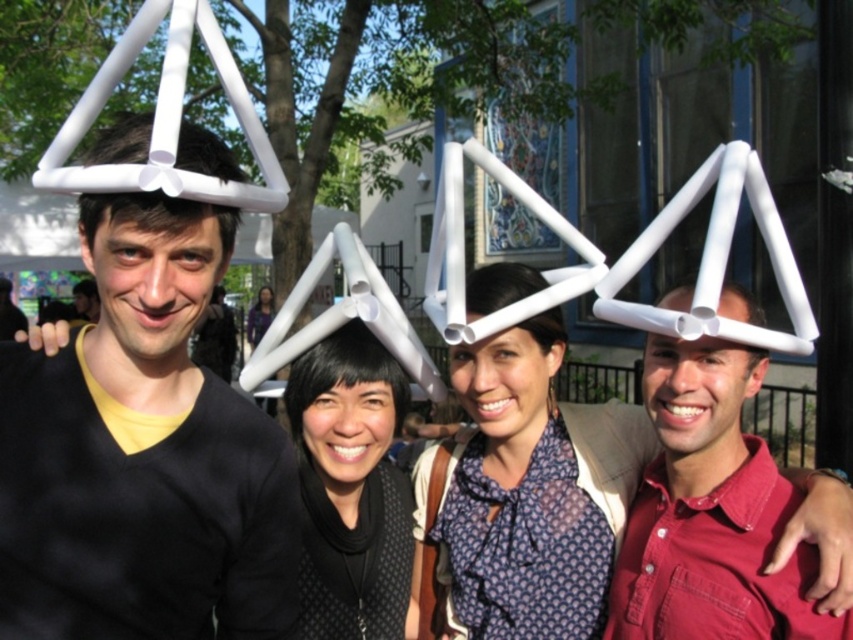
Question: Is black matte headpiece at center smaller than white matte triangle at right?

Choices:
 (A) yes
 (B) no

Answer: (B)

Question: Is matte white helmet at center to the left of matte black hair at upper left from the viewer's perspective?

Choices:
 (A) no
 (B) yes

Answer: (A)

Question: Which object appears closest to the camera in this image?

Choices:
 (A) black matte headpiece at center
 (B) matte white structure at center
 (C) white matte triangle at center

Answer: (C)

Question: Can you confirm if white matte geometric structure at center is positioned to the left of white matte triangle at right?

Choices:
 (A) no
 (B) yes

Answer: (B)

Question: Considering the real-world distances, which object is farthest from the white matte triangle at right?

Choices:
 (A) matte white structure at center
 (B) matte black sweater at center
 (C) white matte geometric structure at center

Answer: (B)

Question: Which point appears farthest from the camera in this image?

Choices:
 (A) (86, 289)
 (B) (93, 516)
 (C) (399, 524)

Answer: (A)